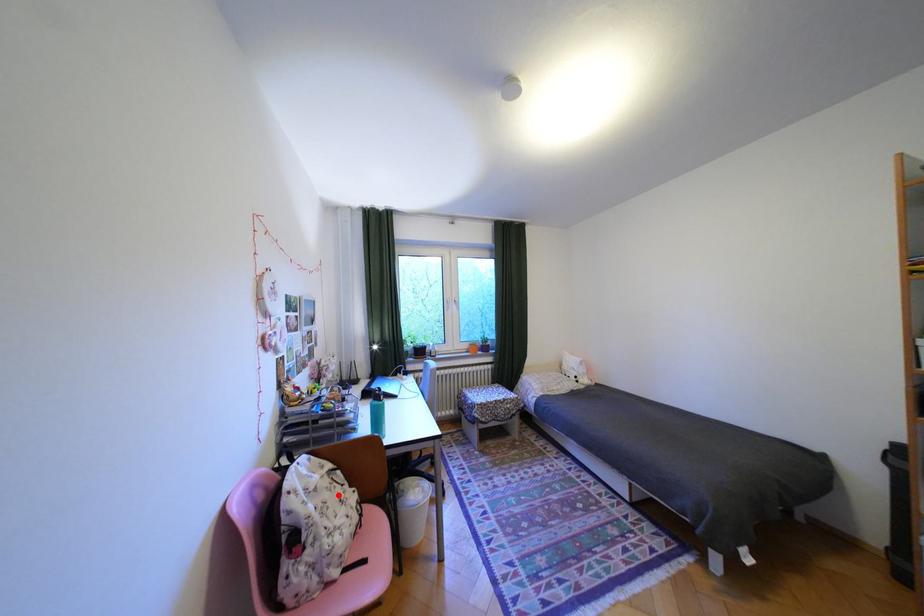
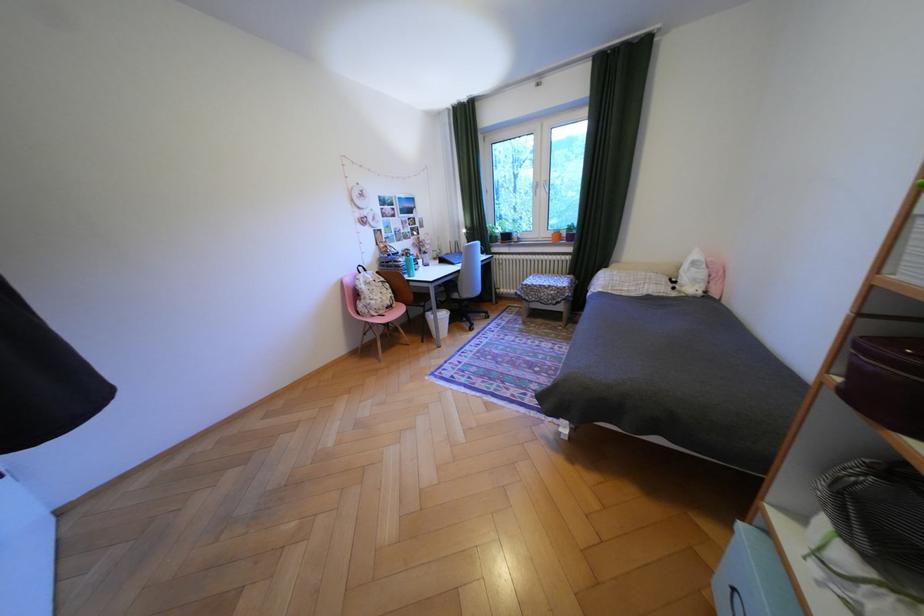
The point at the highlighted location is marked in the first image. Where is the corresponding point in the second image?

(386, 288)